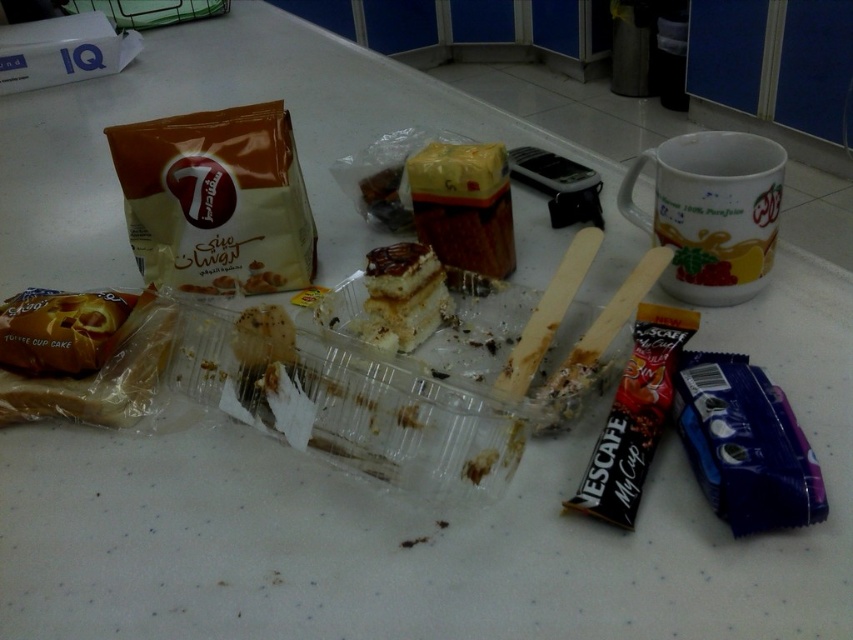
Question: Can you confirm if matte plastic bag at upper left is positioned below golden plastic cupcake at lower left?

Choices:
 (A) yes
 (B) no

Answer: (B)

Question: Based on their relative distances, which object is farther from the matte plastic bag at upper left?

Choices:
 (A) golden plastic cupcake at lower left
 (B) spongy yellow cake at center
 (C) yellow plastic container at center

Answer: (C)

Question: Can you confirm if matte plastic bag at upper left is positioned to the right of golden plastic cupcake at lower left?

Choices:
 (A) yes
 (B) no

Answer: (A)

Question: Which point is farther from the camera taking this photo?

Choices:
 (A) (178, 157)
 (B) (456, 180)
 (C) (26, 394)

Answer: (A)

Question: Which of the following is the closest to the observer?

Choices:
 (A) (399, 257)
 (B) (489, 243)

Answer: (A)

Question: Is matte plastic bag at upper left positioned at the back of golden plastic cupcake at lower left?

Choices:
 (A) no
 (B) yes

Answer: (B)